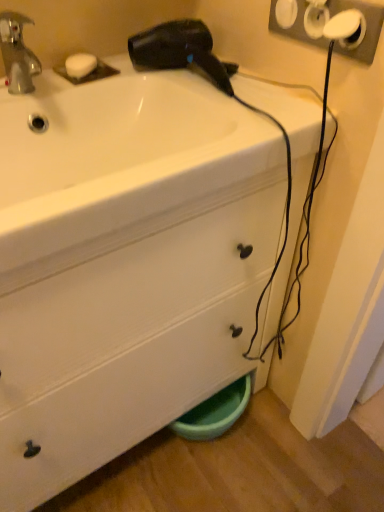
Question: Is white plastic socket at upper right turned away from black plastic hair dryer at upper center?

Choices:
 (A) no
 (B) yes

Answer: (A)

Question: Is white plastic socket at upper right closer to camera compared to black plastic hair dryer at upper center?

Choices:
 (A) yes
 (B) no

Answer: (A)

Question: Is white plastic socket at upper right behind black plastic hair dryer at upper center?

Choices:
 (A) no
 (B) yes

Answer: (A)

Question: Does white plastic socket at upper right have a greater height compared to black plastic hair dryer at upper center?

Choices:
 (A) no
 (B) yes

Answer: (B)

Question: Does white plastic socket at upper right have a lesser height compared to black plastic hair dryer at upper center?

Choices:
 (A) no
 (B) yes

Answer: (A)

Question: From a real-world perspective, is white plastic socket at upper right positioned over black plastic hair dryer at upper center based on gravity?

Choices:
 (A) yes
 (B) no

Answer: (A)

Question: Is white matte soap at upper left closer to camera compared to white plastic socket at upper right?

Choices:
 (A) yes
 (B) no

Answer: (B)

Question: Can you confirm if white matte soap at upper left is wider than white plastic socket at upper right?

Choices:
 (A) yes
 (B) no

Answer: (A)

Question: From the image's perspective, is white matte soap at upper left above white plastic socket at upper right?

Choices:
 (A) yes
 (B) no

Answer: (A)

Question: Does white matte soap at upper left have a larger size compared to white plastic socket at upper right?

Choices:
 (A) no
 (B) yes

Answer: (A)

Question: Is white matte soap at upper left positioned with its back to white plastic socket at upper right?

Choices:
 (A) no
 (B) yes

Answer: (A)

Question: From a real-world perspective, is white matte soap at upper left below white plastic socket at upper right?

Choices:
 (A) yes
 (B) no

Answer: (A)

Question: From a real-world perspective, is white plastic socket at upper right positioned under white matte soap at upper left based on gravity?

Choices:
 (A) yes
 (B) no

Answer: (B)